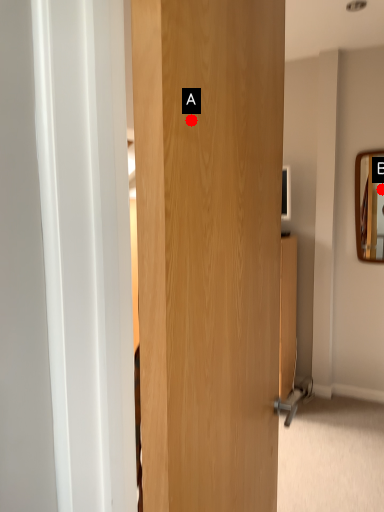
Question: Two points are circled on the image, labeled by A and B beside each circle. Which point appears closest to the camera in this image?

Choices:
 (A) A is closer
 (B) B is closer

Answer: (A)